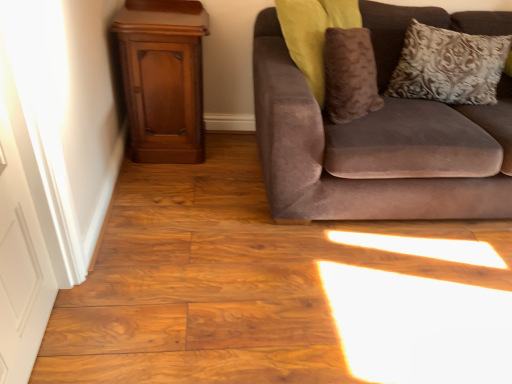
Question: Can you confirm if suede couch at right is thinner than white painted wood door at left?

Choices:
 (A) yes
 (B) no

Answer: (B)

Question: Is suede couch at right placed right next to white painted wood door at left?

Choices:
 (A) no
 (B) yes

Answer: (A)

Question: Can you confirm if suede couch at right is positioned to the right of white painted wood door at left?

Choices:
 (A) yes
 (B) no

Answer: (A)

Question: Could you tell me if suede couch at right is facing white painted wood door at left?

Choices:
 (A) yes
 (B) no

Answer: (B)

Question: Is white painted wood door at left inside suede couch at right?

Choices:
 (A) no
 (B) yes

Answer: (A)

Question: From a real-world perspective, is suede couch at right positioned over white painted wood door at left based on gravity?

Choices:
 (A) no
 (B) yes

Answer: (A)

Question: Is white painted wood door at left next to mahogany wood dresser at left and touching it?

Choices:
 (A) yes
 (B) no

Answer: (B)

Question: Considering the relative sizes of white painted wood door at left and mahogany wood dresser at left in the image provided, is white painted wood door at left wider than mahogany wood dresser at left?

Choices:
 (A) yes
 (B) no

Answer: (B)

Question: Can you confirm if white painted wood door at left is shorter than mahogany wood dresser at left?

Choices:
 (A) no
 (B) yes

Answer: (A)

Question: Is white painted wood door at left to the right of mahogany wood dresser at left from the viewer's perspective?

Choices:
 (A) yes
 (B) no

Answer: (B)

Question: From a real-world perspective, is white painted wood door at left positioned over mahogany wood dresser at left based on gravity?

Choices:
 (A) yes
 (B) no

Answer: (A)

Question: Considering the relative sizes of white painted wood door at left and mahogany wood dresser at left in the image provided, is white painted wood door at left taller than mahogany wood dresser at left?

Choices:
 (A) no
 (B) yes

Answer: (B)

Question: From a real-world perspective, is mahogany wood dresser at left below silver textured pillow at upper right?

Choices:
 (A) no
 (B) yes

Answer: (B)